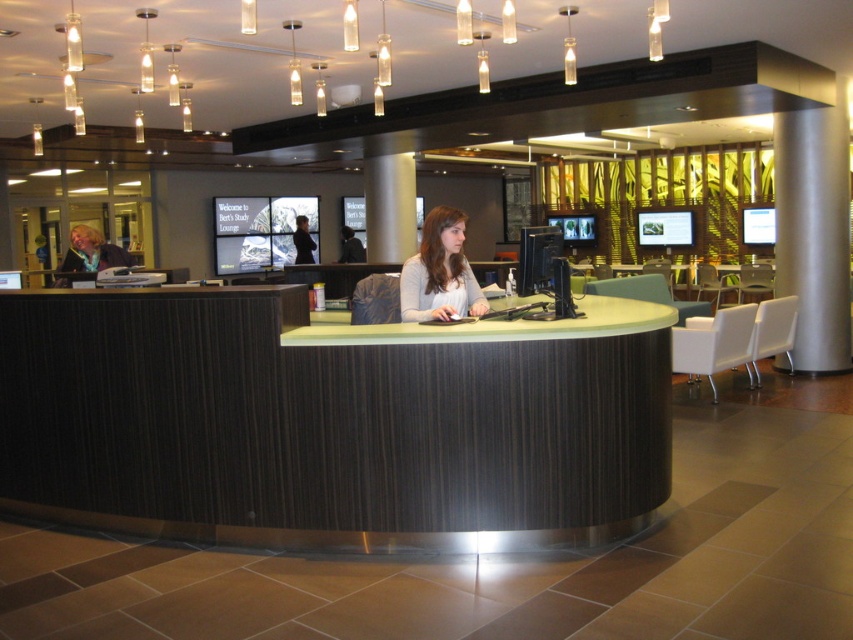
Question: Is light gray sweater at center to the left of matte black jacket at left from the viewer's perspective?

Choices:
 (A) yes
 (B) no

Answer: (B)

Question: Does dark wood/striped pattern information desk at center have a smaller size compared to light gray sweater at center?

Choices:
 (A) no
 (B) yes

Answer: (A)

Question: Among these points, which one is nearest to the camera?

Choices:
 (A) (521, 410)
 (B) (78, 234)

Answer: (A)

Question: Based on their relative distances, which object is farther from the matte black jacket at left?

Choices:
 (A) dark wood/striped pattern information desk at center
 (B) light gray sweater at center

Answer: (B)

Question: In this image, where is light gray sweater at center located relative to matte black jacket at left?

Choices:
 (A) above
 (B) below

Answer: (B)

Question: Which point is farther from the camera taking this photo?

Choices:
 (A) (438, 296)
 (B) (80, 232)

Answer: (B)